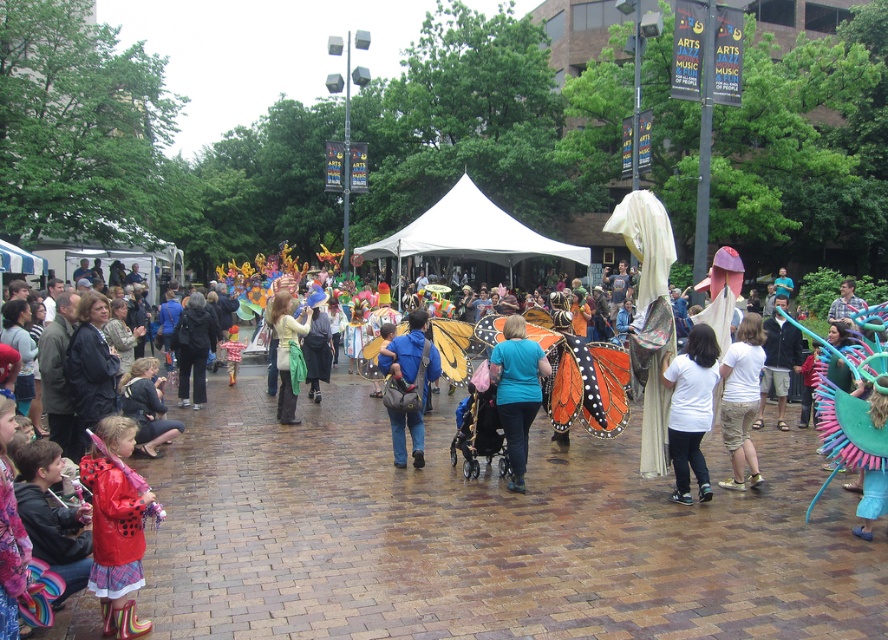
Question: Does blue fabric backpack at center have a lesser width compared to black fabric jacket at center?

Choices:
 (A) yes
 (B) no

Answer: (A)

Question: Which point is closer to the camera taking this photo?

Choices:
 (A) (496, 376)
 (B) (419, 340)
 (C) (731, 456)
 (D) (199, 316)

Answer: (A)

Question: Is rubberized red raincoat at lower left wider than blue fabric backpack at center?

Choices:
 (A) yes
 (B) no

Answer: (B)

Question: Which point appears closest to the camera in this image?

Choices:
 (A) (405, 385)
 (B) (744, 376)

Answer: (B)

Question: Which is farther from the white matte shirt at center?

Choices:
 (A) white cotton shirt at center
 (B) blue fabric backpack at center
 (C) matte green scarf at center

Answer: (C)

Question: Can you confirm if rubberized red raincoat at lower left is thinner than black fabric jacket at center?

Choices:
 (A) no
 (B) yes

Answer: (B)